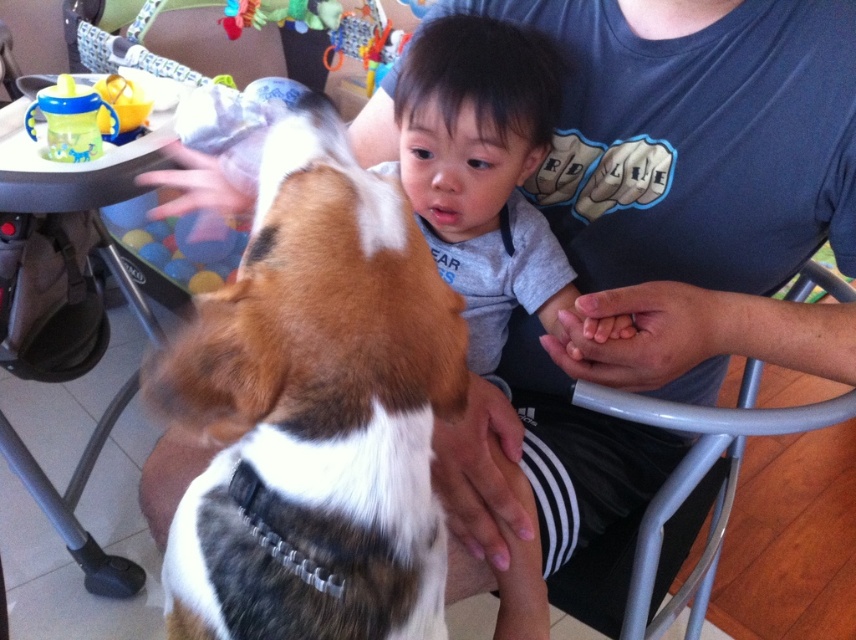
You are holding a 12 inch long toy and want to place it so that it reaches from your current position to the point at point (235, 628). Is the toy long enough?

The point at point (235, 628) is 16.23 inches from the viewer. Since the toy is only 12 inches long, it is not long enough to reach that point.

Please provide the 2D coordinates of the brown and white fur at center in the image.

The brown and white fur at center is located at coordinates (x=314, y=410).

You are a parent trying to decide whether to place the translucent plastic sippy cup at upper left on the gray plastic chair at center. Based on their sizes, will the sippy cup fit on the chair?

The gray plastic chair at center is much taller than the translucent plastic sippy cup at upper left, so the sippy cup will fit on the chair since it is smaller in height.